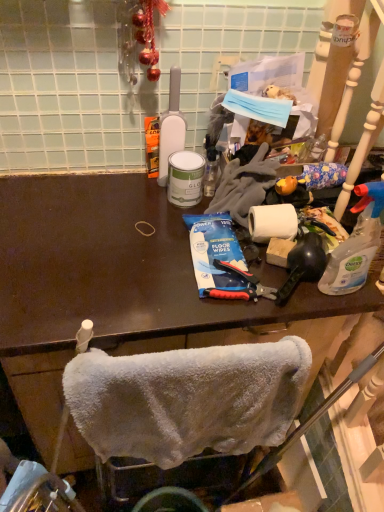
Question: Does white matte bottle at upper center, the 2th bottle ordered from the bottom, touch blue plastic toothpaste at center?

Choices:
 (A) no
 (B) yes

Answer: (A)

Question: Does white matte bottle at upper center, arranged as the second bottle when viewed from the front, come in front of blue plastic toothpaste at center?

Choices:
 (A) no
 (B) yes

Answer: (A)

Question: Is white matte bottle at upper center, arranged as the second bottle when viewed from the front, smaller than blue plastic toothpaste at center?

Choices:
 (A) yes
 (B) no

Answer: (B)

Question: Is white matte bottle at upper center, arranged as the 1th bottle when viewed from the top, outside of blue plastic toothpaste at center?

Choices:
 (A) no
 (B) yes

Answer: (B)

Question: From a real-world perspective, does white matte bottle at upper center, arranged as the 1th bottle when viewed from the top, sit lower than blue plastic toothpaste at center?

Choices:
 (A) no
 (B) yes

Answer: (A)

Question: Considering their positions, is white matte bottle at upper center, placed as the 1th bottle when sorted from left to right, located in front of or behind white fluffy towel at lower center?

Choices:
 (A) behind
 (B) front

Answer: (A)

Question: Is white matte bottle at upper center, positioned as the first bottle in back-to-front order, inside the boundaries of white fluffy towel at lower center, or outside?

Choices:
 (A) outside
 (B) inside

Answer: (A)

Question: Considering the positions of white matte bottle at upper center, the 2th bottle ordered from the bottom, and white fluffy towel at lower center in the image, is white matte bottle at upper center, the 2th bottle ordered from the bottom, wider or thinner than white fluffy towel at lower center?

Choices:
 (A) wide
 (B) thin

Answer: (A)

Question: Based on their sizes in the image, would you say white matte bottle at upper center, placed as the 1th bottle when sorted from left to right, is bigger or smaller than white fluffy towel at lower center?

Choices:
 (A) small
 (B) big

Answer: (A)

Question: Choose the correct answer: Is white matte bottle at upper center, arranged as the second bottle when viewed from the front, inside clear plastic spray bottle at right, which is the 1th bottle from right to left, or outside it?

Choices:
 (A) inside
 (B) outside

Answer: (B)

Question: Looking at the image, does white matte bottle at upper center, placed as the 1th bottle when sorted from left to right, seem bigger or smaller compared to clear plastic spray bottle at right, arranged as the 1th bottle when ordered from the bottom?

Choices:
 (A) small
 (B) big

Answer: (B)

Question: From a real-world perspective, is white matte bottle at upper center, arranged as the 1th bottle when viewed from the top, above or below clear plastic spray bottle at right, which is the 1th bottle from right to left?

Choices:
 (A) above
 (B) below

Answer: (A)

Question: From the image's perspective, is white matte bottle at upper center, which is the 2th bottle in right-to-left order, above or below clear plastic spray bottle at right, the first bottle from the front?

Choices:
 (A) above
 (B) below

Answer: (A)

Question: In terms of size, does blue plastic toothpaste at center appear bigger or smaller than white matte bottle at upper center, placed as the 1th bottle when sorted from left to right?

Choices:
 (A) big
 (B) small

Answer: (B)

Question: Considering the positions of blue plastic toothpaste at center and white matte bottle at upper center, positioned as the first bottle in back-to-front order, in the image, is blue plastic toothpaste at center wider or thinner than white matte bottle at upper center, positioned as the first bottle in back-to-front order,?

Choices:
 (A) thin
 (B) wide

Answer: (B)